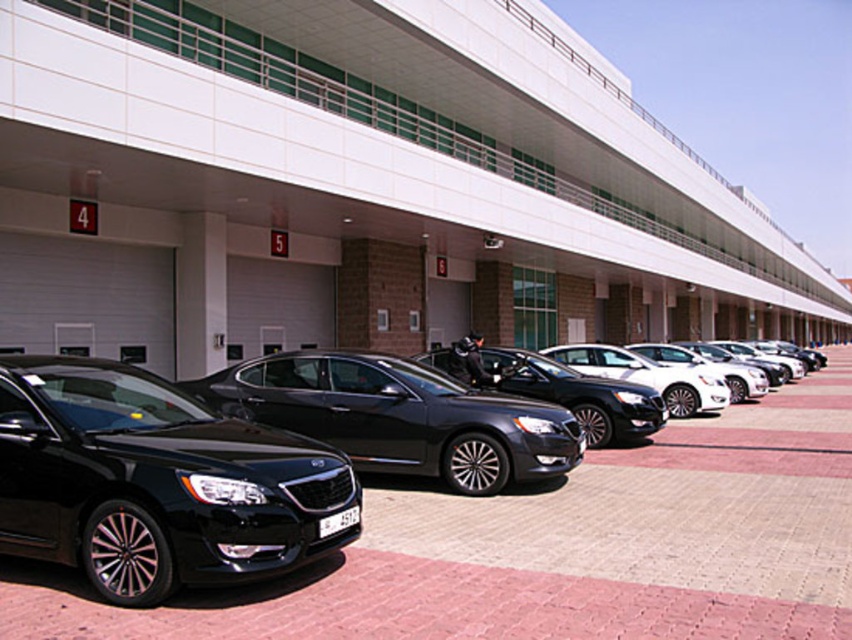
Does point (588, 568) lie in front of point (597, 403)?

Yes, it is in front of point (597, 403).

Does point (375, 502) lie behind point (612, 385)?

No, it is not.

Where is `shiny black sedan at center`? The width and height of the screenshot is (852, 640). shiny black sedan at center is located at coordinates (666, 506).

Which is above, black metallic sedan at center or glossy black sedan at center?

glossy black sedan at center

Identify the location of black metallic sedan at center. The height and width of the screenshot is (640, 852). (157, 483).

Is point (281, 547) closer to camera compared to point (412, 372)?

That is True.

Image resolution: width=852 pixels, height=640 pixels. I want to click on black metallic sedan at center, so click(157, 483).

Who is lower down, black metallic sedan at center or white glossy sedan at center?

black metallic sedan at center is below.

Is black metallic sedan at center wider than white glossy sedan at center?

No, black metallic sedan at center is not wider than white glossy sedan at center.

Measure the distance between black metallic sedan at center and camera.

The distance of black metallic sedan at center from camera is 4.18 meters.

In order to click on black metallic sedan at center in this screenshot , I will do `click(157, 483)`.